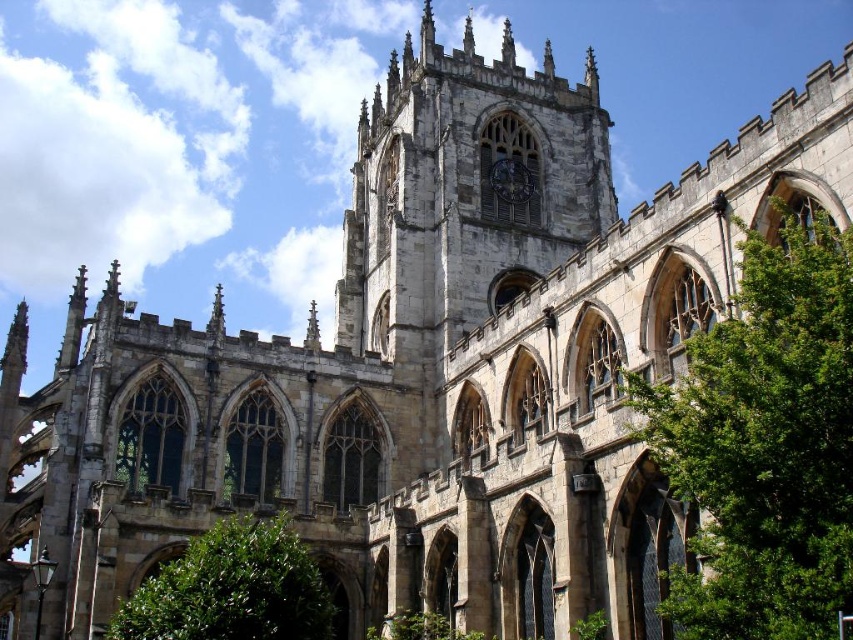
You are standing in front of the cathedral and want to take a photo that includes both the green leafy tree at right and the green leafy bush at lower left. Which of the two plants should you focus on if you want to capture the wider one in your shot?

The green leafy bush at lower left is wider than the green leafy tree at right, so focusing on it will capture the wider plant in the photo.

Based on the scene description, where is the green leafy tree at right located in the image?

The green leafy tree at right is located at point (764, 444) in the image.

You are standing in front of the cathedral and want to take a photo of both the green leafy bush at lower left and the dark gray stone clock at center. Which object should you focus on first to ensure both are in clear view?

You should focus on the green leafy bush at lower left first since it is closer to the viewer than the dark gray stone clock at center. By focusing on the closer object, the clock will also be in focus due to the depth of field.